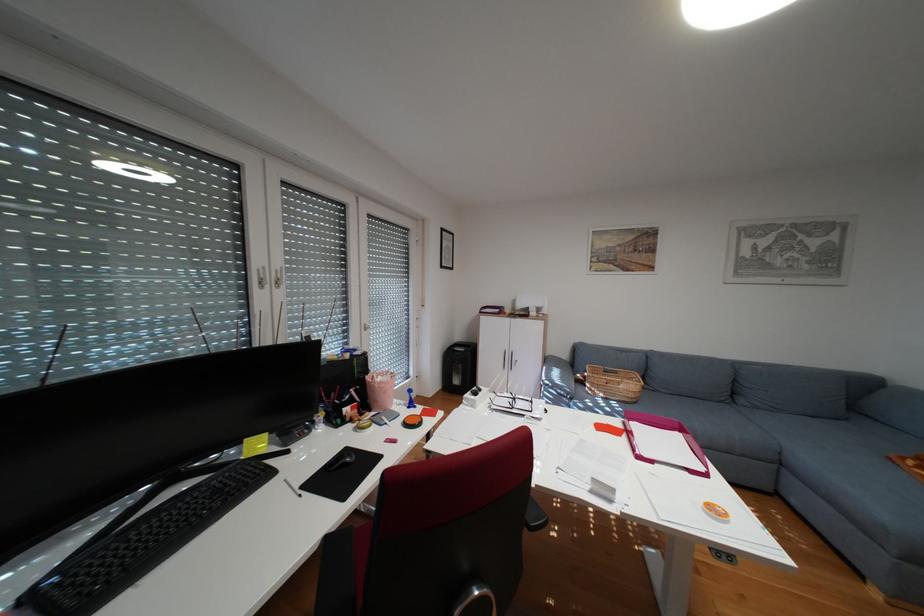
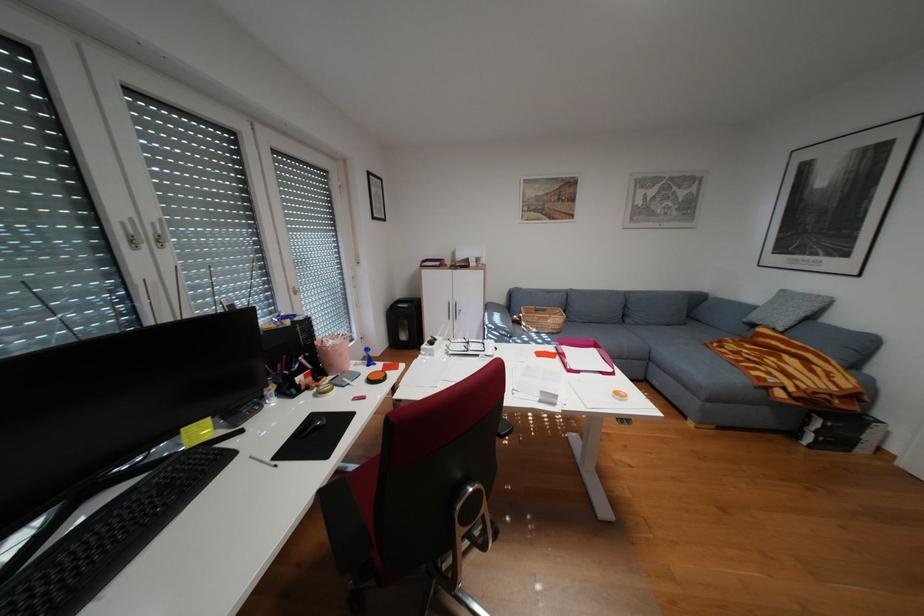
The point at (271,269) is marked in the first image. Where is the corresponding point in the second image?

(135, 223)